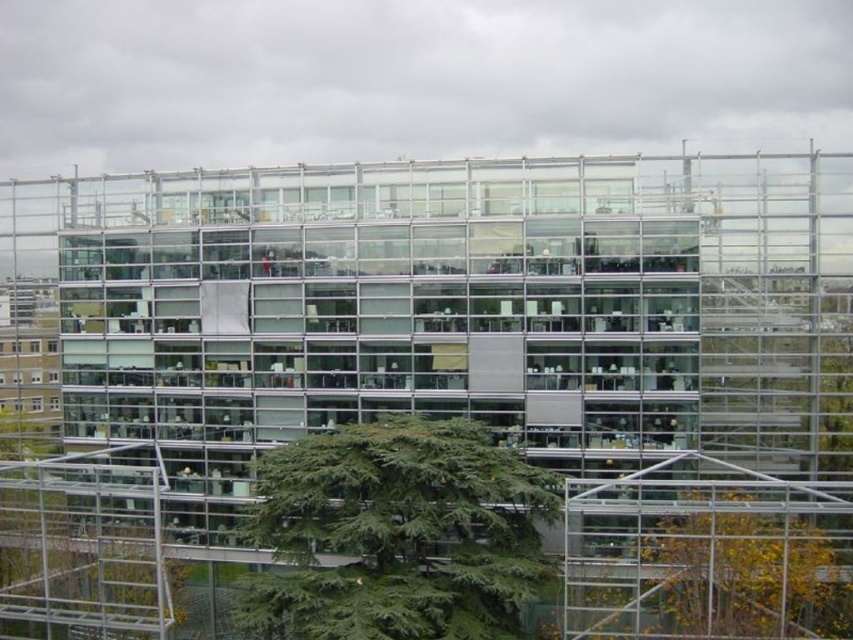
Is green needle-like leaves at center bigger than green leafy tree at lower right?

Incorrect, green needle-like leaves at center is not larger than green leafy tree at lower right.

Who is taller, green needle-like leaves at center or green leafy tree at lower right?

Standing taller between the two is green leafy tree at lower right.

Who is more distant from viewer, (469, 497) or (653, 516)?

The point (653, 516) is behind.

Where is `green needle-like leaves at center`? The image size is (853, 640). green needle-like leaves at center is located at coordinates (396, 532).